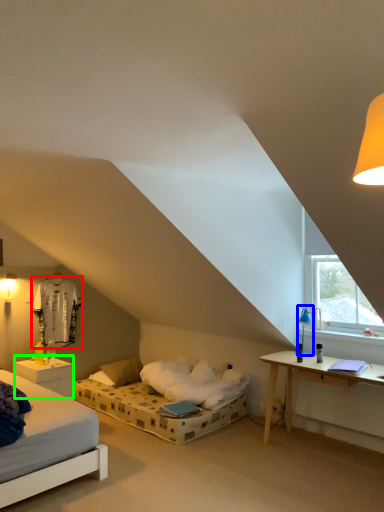
Question: Based on their relative distances, which object is nearer to sheet (highlighted by a red box)? Choose from table lamp (highlighted by a blue box) and nightstand (highlighted by a green box).

Choices:
 (A) table lamp
 (B) nightstand

Answer: (B)